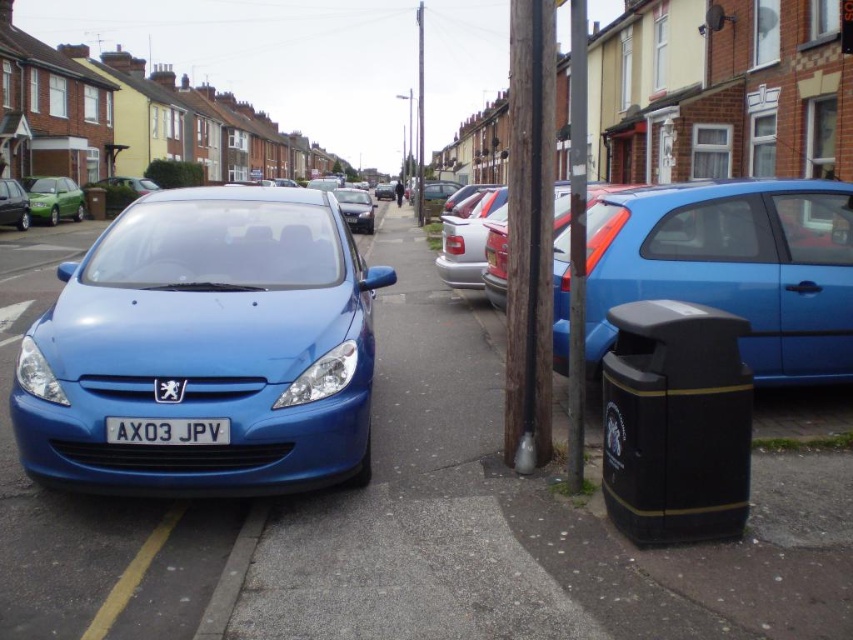
Please look at the blue Peugeot car parked on the left side of the street. There is a point marked at coordinates (167, 429). What object does this point correspond to on the car?

The point at coordinates (167, 429) corresponds to the blue plastic license plate at center.

You are a delivery driver who needs to park your vehicle between the green matte sedan at left and the matte blue hatchback at left. Based on their positions, which side of the street should you choose to park on?

The green matte sedan at left is located above the matte blue hatchback at left, which means they are parked on the same side of the street. Therefore, you should park on the left side of the street between them.

You are a delivery driver who needs to read the license plate of the blue plastic license plate at center. However, you notice the satin black sedan at center is blocking your view. Can you estimate how much taller the sedan is compared to the license plate?

The blue plastic license plate at center is not as tall as the satin black sedan at center, so the sedan is taller than the license plate.